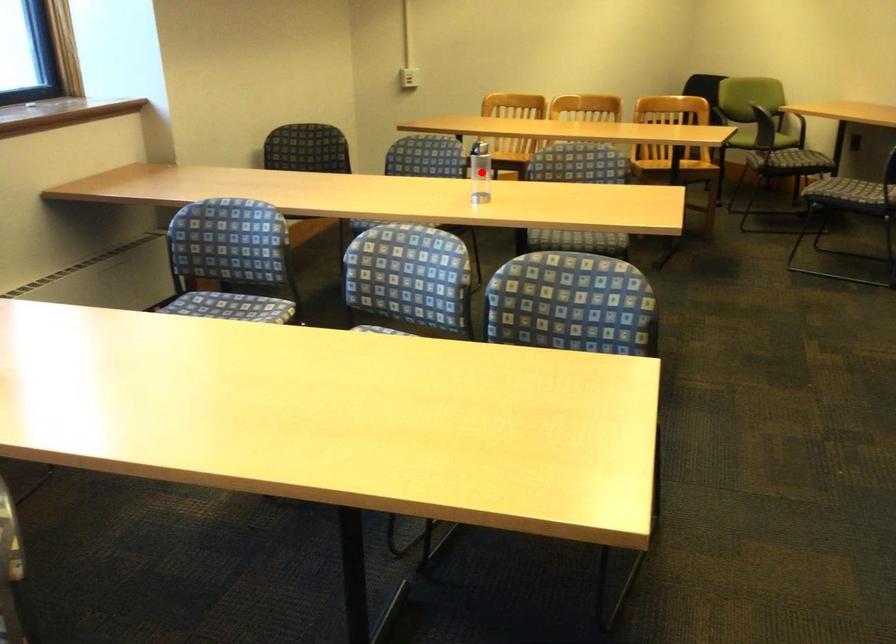
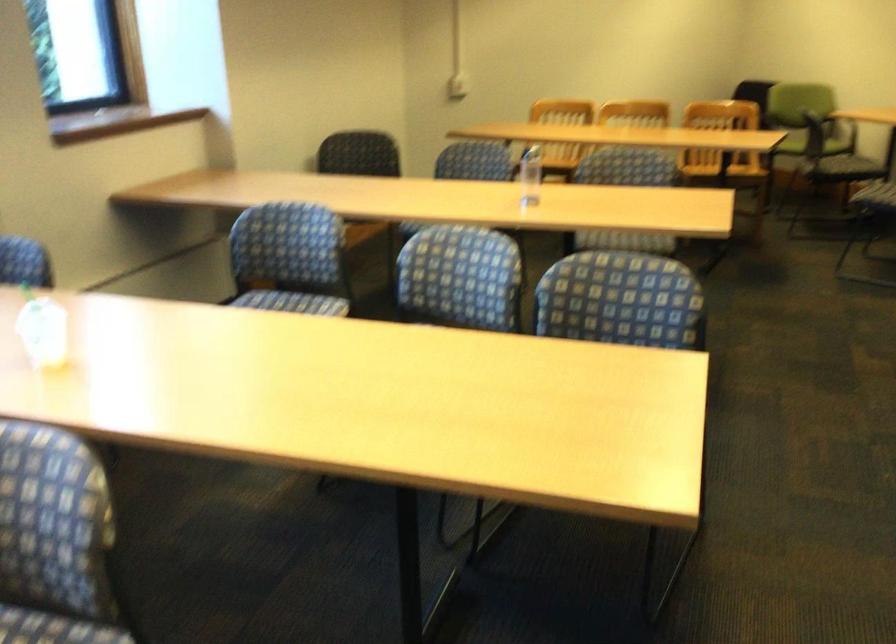
Find the pixel in the second image that matches the highlighted location in the first image.

(530, 176)